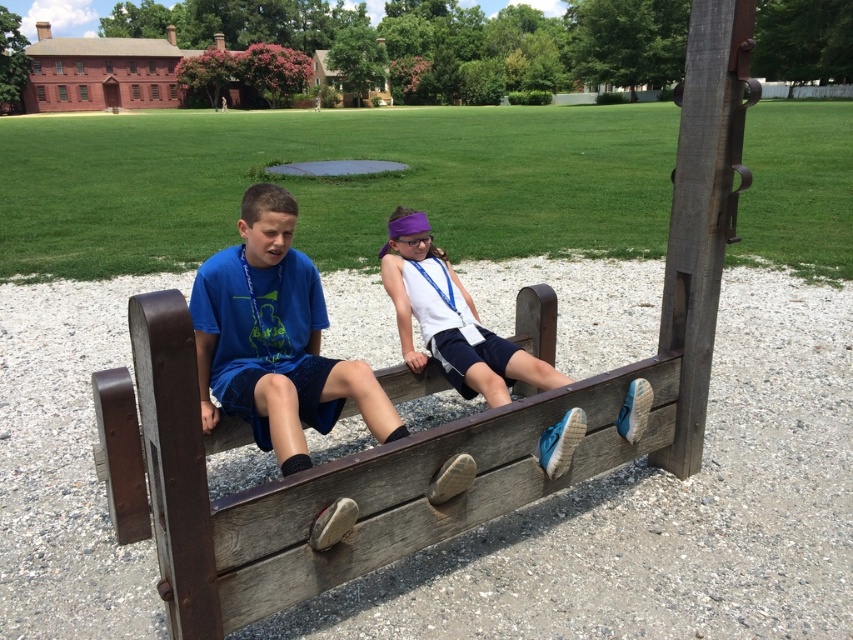
Between blue fabric shirt at center and white matte tank top at center, which one is positioned lower?

blue fabric shirt at center is below.

Measure the distance between blue fabric shirt at center and camera.

blue fabric shirt at center is 2.28 meters away from camera.

Image resolution: width=853 pixels, height=640 pixels. What are the coordinates of `blue fabric shirt at center` in the screenshot? It's located at click(276, 339).